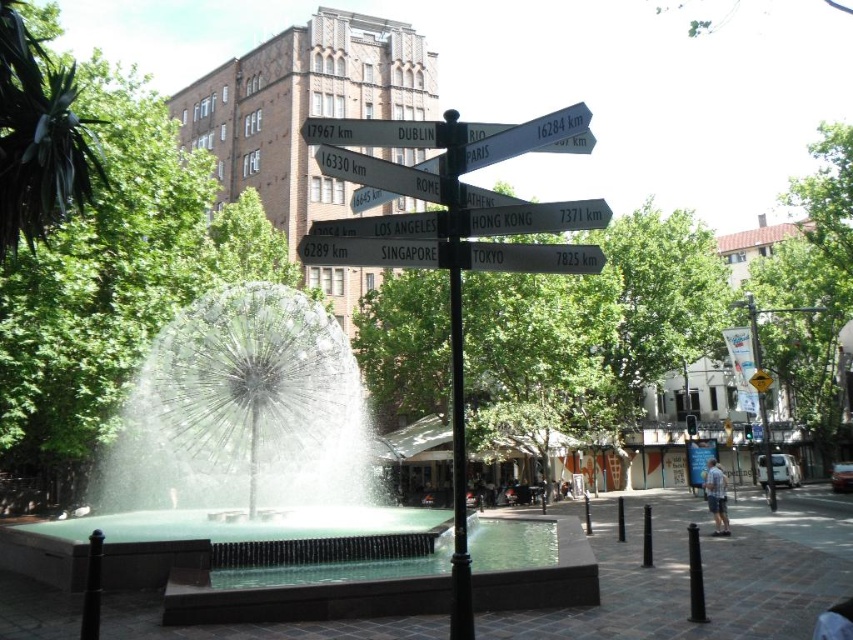
Does black metal pole at center appear on the left side of white plastic sign at center?

Incorrect, black metal pole at center is not on the left side of white plastic sign at center.

Is point (463, 573) behind point (431, 227)?

Yes, it is behind point (431, 227).

Does point (448, 173) come in front of point (432, 212)?

Yes.

I want to click on black metal pole at center, so click(456, 372).

Is polished stone fountain at center smaller than white plastic sign at center?

Incorrect, polished stone fountain at center is not smaller in size than white plastic sign at center.

Can you confirm if polished stone fountain at center is wider than white plastic sign at center?

Yes.

What are the coordinates of `polished stone fountain at center` in the screenshot? It's located at (248, 477).

Is point (360, 166) closer to camera compared to point (416, 212)?

That is True.

Is point (326, 160) more distant than point (378, 230)?

No, (326, 160) is in front of (378, 230).

Which is behind, point (486, 195) or point (358, 218)?

Positioned behind is point (486, 195).

This screenshot has width=853, height=640. I want to click on white plastic signpost at center, so click(x=380, y=177).